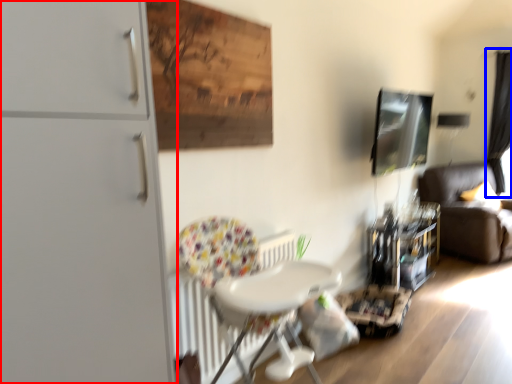
Question: Among these objects, which one is farthest to the camera, dresser (highlighted by a red box) or curtain (highlighted by a blue box)?

Choices:
 (A) dresser
 (B) curtain

Answer: (B)